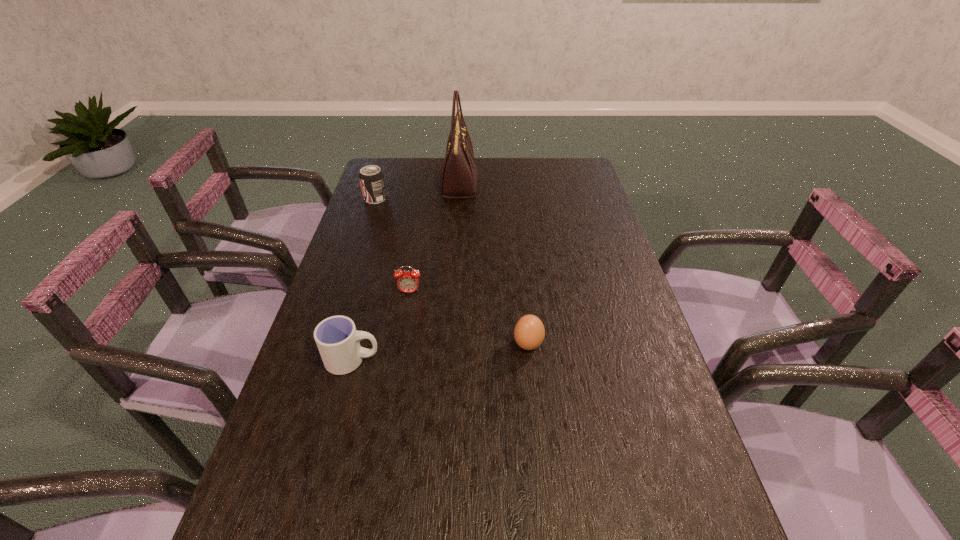
Locate an element on the screen. The height and width of the screenshot is (540, 960). free location located on the right of the second object from right to left is located at coordinates (609, 345).

Find the location of `blank space located 0.320m on the face of the fourth nearest object`. blank space located 0.320m on the face of the fourth nearest object is located at coordinates (392, 398).

Locate an element on the screen. The width and height of the screenshot is (960, 540). object at the far edge is located at coordinates (458, 177).

You are a GUI agent. You are given a task and a screenshot of the screen. Output one action in this format:
    pyautogui.click(x=<x>, y=<y>)
    Task: Click on the soda can that is at the left edge
    
    Given the screenshot: What is the action you would take?
    pyautogui.click(x=371, y=177)

Identify the location of cup located at the left edge. The height and width of the screenshot is (540, 960). (337, 339).

This screenshot has width=960, height=540. Find the location of `vacant area at the left edge of the desktop`. vacant area at the left edge of the desktop is located at coordinates (372, 253).

In the image, there is a desktop. At what (x,y) coordinates should I click in order to perform the action: click on free region at the right edge. Please return your answer as a coordinate pair (x, y). The width and height of the screenshot is (960, 540). Looking at the image, I should click on (607, 238).

Find the location of a particular element. The width and height of the screenshot is (960, 540). free space at the far left corner is located at coordinates (392, 183).

Image resolution: width=960 pixels, height=540 pixels. Find the location of `free space at the far right corner of the desktop`. free space at the far right corner of the desktop is located at coordinates (585, 180).

Where is `free area in between the fourth object from right to left and the boiled egg`? This screenshot has height=540, width=960. free area in between the fourth object from right to left and the boiled egg is located at coordinates (468, 319).